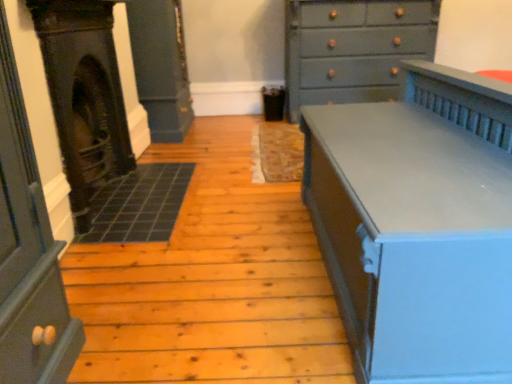
Question: Is dark gray stone fireplace at left bigger or smaller than matte gray chest of drawers at right, placed as the 1th chest of drawers when sorted from bottom to top?

Choices:
 (A) big
 (B) small

Answer: (B)

Question: Considering their positions, is dark gray stone fireplace at left located in front of or behind matte gray chest of drawers at right, which ranks as the 2th chest of drawers in top-to-bottom order?

Choices:
 (A) front
 (B) behind

Answer: (B)

Question: Based on their relative distances, which object is nearer to the dark gray stone fireplace at left?

Choices:
 (A) matte gray chest of drawers at upper right, which is counted as the 2th chest of drawers, starting from the front
 (B) matte gray chest of drawers at right, which ranks as the 2th chest of drawers in top-to-bottom order

Answer: (B)

Question: Estimate the real-world distances between objects in this image. Which object is farther from the matte gray chest of drawers at upper right, positioned as the 2th chest of drawers in bottom-to-top order?

Choices:
 (A) matte gray chest of drawers at right, placed as the 1th chest of drawers when sorted from bottom to top
 (B) dark gray stone fireplace at left

Answer: (B)